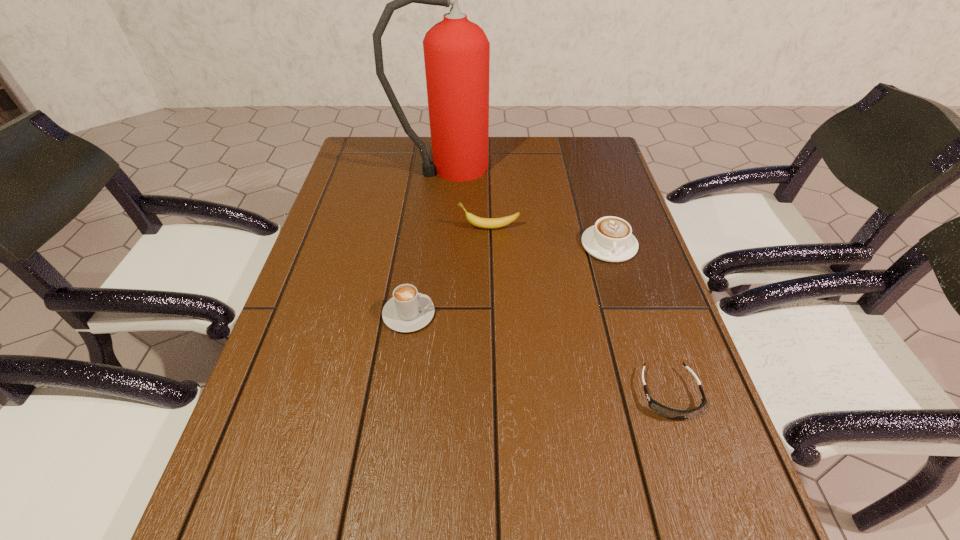
Where is `object positioned at the far left corner`? object positioned at the far left corner is located at coordinates (456, 51).

Where is `vacant region at the far edge of the desktop`? vacant region at the far edge of the desktop is located at coordinates (403, 147).

At what (x,y) coordinates should I click in order to perform the action: click on vacant area at the left edge of the desktop. Please return your answer as a coordinate pair (x, y). The image size is (960, 540). Looking at the image, I should click on [263, 380].

What are the coordinates of `vacant space at the right edge` in the screenshot? It's located at (642, 284).

Locate an element on the screen. vacant space at the far left corner of the desktop is located at coordinates (353, 144).

Locate an element on the screen. This screenshot has width=960, height=540. vacant space at the far right corner is located at coordinates (565, 136).

Where is `free space that is in between the fourth farthest object and the nearest object`? Image resolution: width=960 pixels, height=540 pixels. free space that is in between the fourth farthest object and the nearest object is located at coordinates (540, 354).

Locate an element on the screen. vacant region between the left cappuccino and the fire extinguisher is located at coordinates (427, 241).

At what (x,y) coordinates should I click in order to perform the action: click on free space that is in between the left cappuccino and the farthest object. Please return your answer as a coordinate pair (x, y). The image size is (960, 540). Looking at the image, I should click on (427, 241).

You are a GUI agent. You are given a task and a screenshot of the screen. Output one action in this format:
    pyautogui.click(x=<x>, y=<y>)
    Task: Click on the empty location between the left cappuccino and the farthest object
    This screenshot has height=540, width=960.
    Given the screenshot: What is the action you would take?
    pyautogui.click(x=427, y=241)